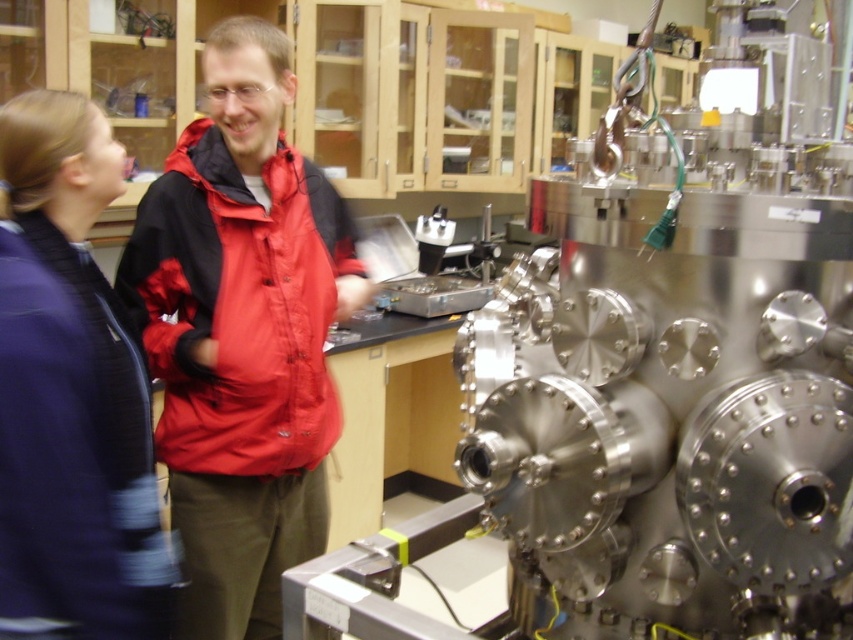
Question: Which of the following is the closest to the observer?

Choices:
 (A) red nylon jacket at center
 (B) blue fabric jacket at left

Answer: (B)

Question: Which point is farther to the camera?

Choices:
 (A) red nylon jacket at center
 (B) red matte jacket at center
 (C) blue fabric jacket at left

Answer: (A)

Question: Can you confirm if red matte jacket at center is positioned to the right of red nylon jacket at center?

Choices:
 (A) no
 (B) yes

Answer: (A)

Question: Where is red matte jacket at center located in relation to red nylon jacket at center in the image?

Choices:
 (A) right
 (B) left

Answer: (B)

Question: Which object is closer to the camera taking this photo?

Choices:
 (A) red matte jacket at center
 (B) red nylon jacket at center

Answer: (A)

Question: Does red matte jacket at center appear on the left side of red nylon jacket at center?

Choices:
 (A) no
 (B) yes

Answer: (B)